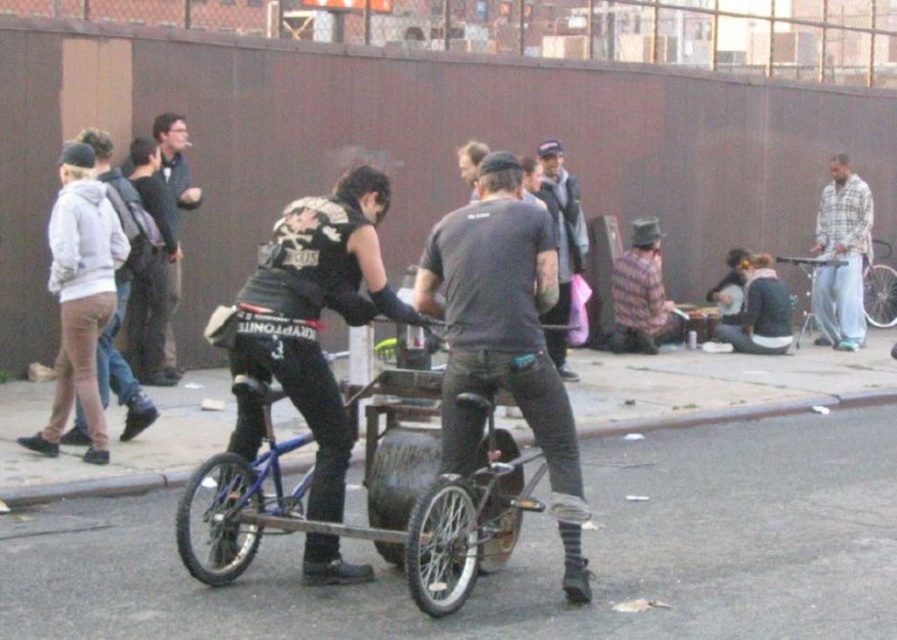
Which is above, plaid flannel shirt at right or blue metallic bicycle at right?

plaid flannel shirt at right

Can you confirm if plaid flannel shirt at right is positioned below blue metallic bicycle at right?

No, plaid flannel shirt at right is not below blue metallic bicycle at right.

Is point (840, 214) positioned after point (867, 278)?

No, (840, 214) is in front of (867, 278).

Find the location of a particular element. The width and height of the screenshot is (897, 640). plaid flannel shirt at right is located at coordinates (841, 253).

Which is below, dark blue shirt at center or blue metallic bicycle at right?

Positioned lower is blue metallic bicycle at right.

Does dark blue shirt at center have a larger size compared to blue metallic bicycle at right?

Incorrect, dark blue shirt at center is not larger than blue metallic bicycle at right.

The width and height of the screenshot is (897, 640). Describe the element at coordinates (175, 163) in the screenshot. I see `dark blue shirt at center` at that location.

Locate an element on the screen. This screenshot has height=640, width=897. dark blue shirt at center is located at coordinates (175, 163).

Can you confirm if smooth asphalt road at center is positioned above dark gray t-shirt at center?

Actually, smooth asphalt road at center is below dark gray t-shirt at center.

Image resolution: width=897 pixels, height=640 pixels. Find the location of `smooth asphalt road at center`. smooth asphalt road at center is located at coordinates (529, 554).

Locate an element on the screen. Image resolution: width=897 pixels, height=640 pixels. smooth asphalt road at center is located at coordinates (529, 554).